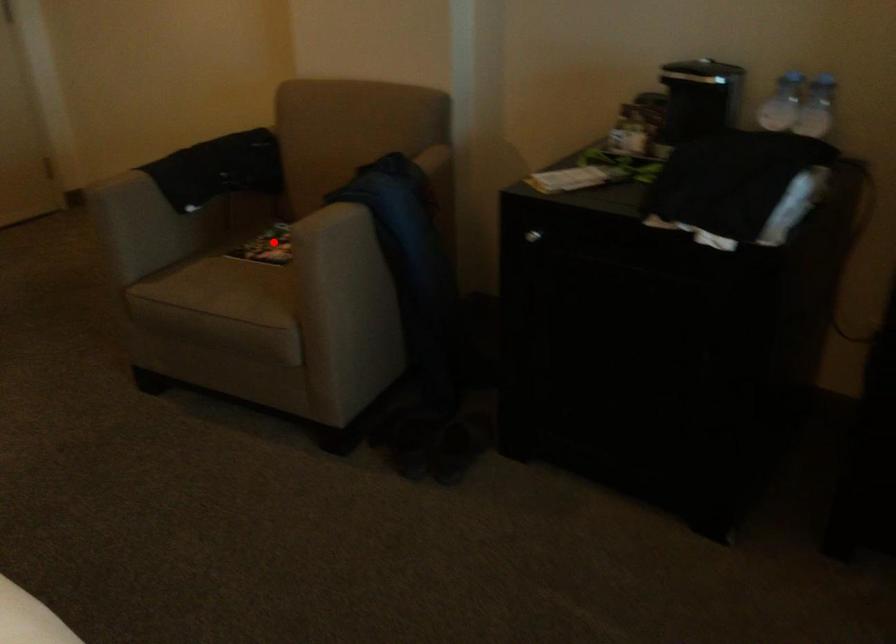
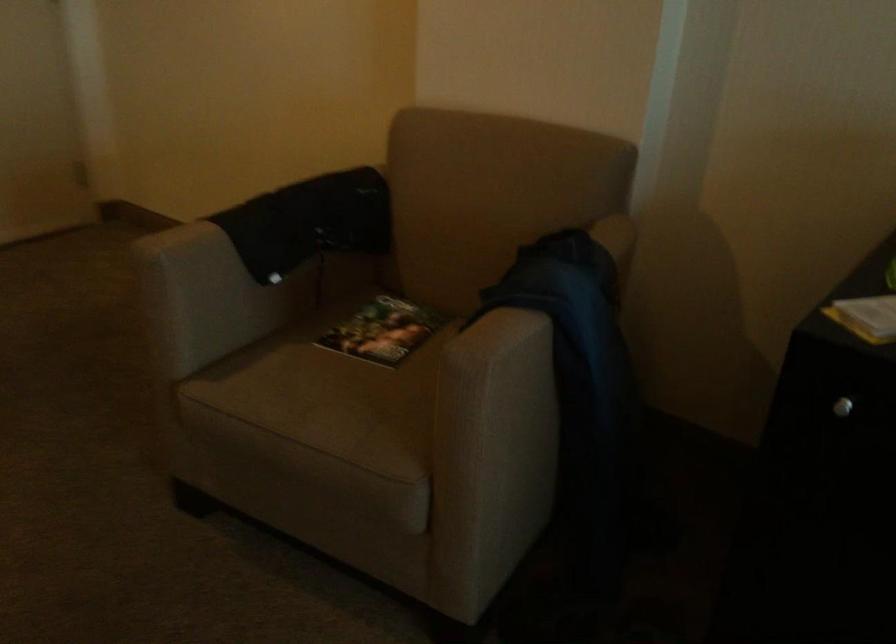
In the second image, find the point that corresponds to the highlighted location in the first image.

(382, 330)